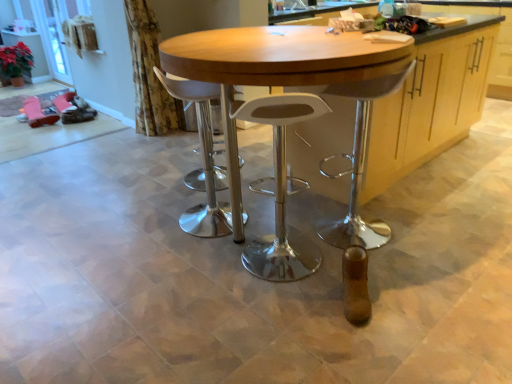
The image size is (512, 384). Find the location of `free location to the right of white plastic stool at center, the second stool from the left`. free location to the right of white plastic stool at center, the second stool from the left is located at coordinates (343, 272).